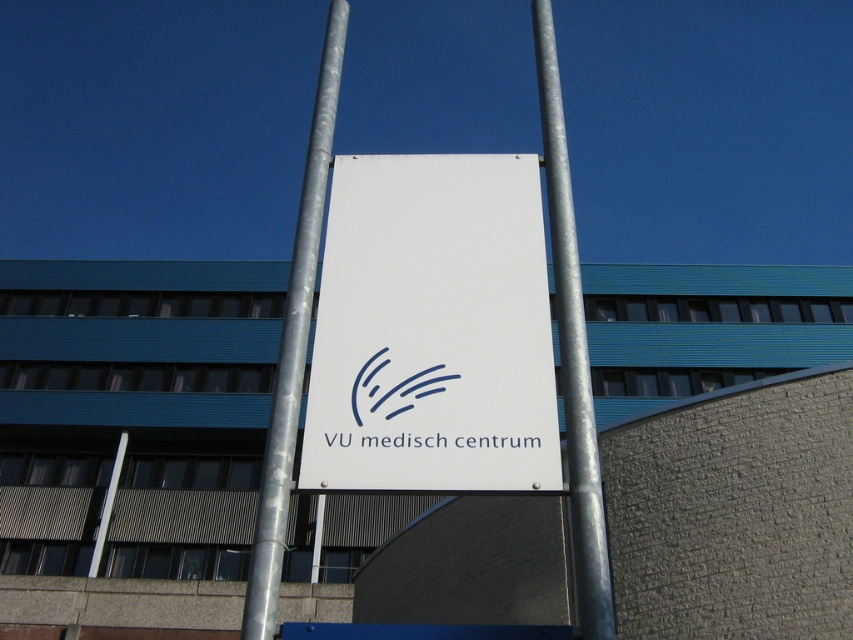
Can you confirm if white matte sign at center is shorter than silver metallic pole at center?

Indeed, white matte sign at center has a lesser height compared to silver metallic pole at center.

Which is more to the right, white matte sign at center or silver metallic pole at center?

Positioned to the right is white matte sign at center.

Does point (556, 472) come closer to viewer compared to point (262, 634)?

No.

The width and height of the screenshot is (853, 640). What are the coordinates of `white matte sign at center` in the screenshot? It's located at (432, 330).

In the scene shown: Is white matte sign at center below metallic silver pole at center?

Incorrect, white matte sign at center is not positioned below metallic silver pole at center.

Which is above, white matte sign at center or metallic silver pole at center?

white matte sign at center is higher up.

I want to click on white matte sign at center, so click(432, 330).

Can you confirm if metallic silver pole at center is thinner than silver metallic pole at center?

Correct, metallic silver pole at center's width is less than silver metallic pole at center's.

Which of these two, metallic silver pole at center or silver metallic pole at center, stands shorter?

A: With less height is metallic silver pole at center.

Who is more distant from viewer, [556,122] or [321,148]?

The point [556,122] is more distant.

The image size is (853, 640). Find the location of `metallic silver pole at center`. metallic silver pole at center is located at coordinates (572, 353).